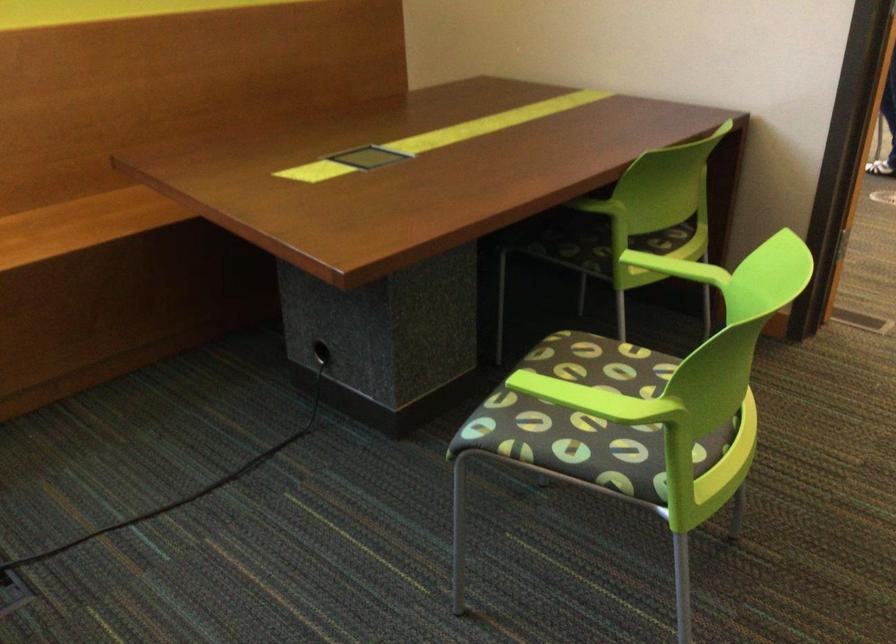
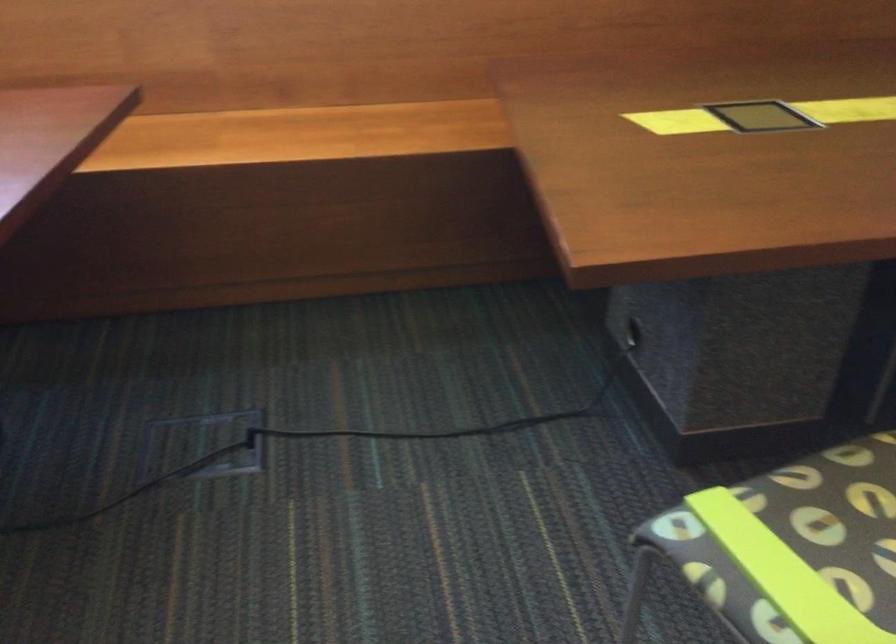
Question: The first image is from the beginning of the video and the second image is from the end. How did the camera likely rotate when shooting the video?

Choices:
 (A) Left
 (B) Right
 (C) Up
 (D) Down

Answer: (A)